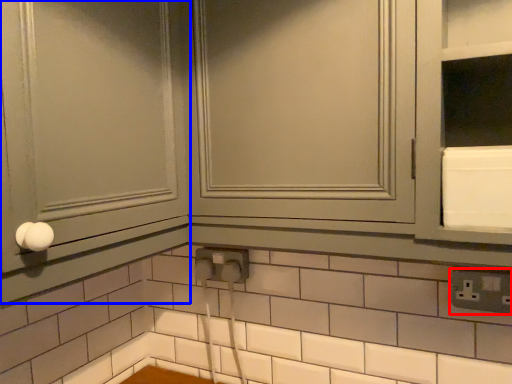
Question: Which of the following is the farthest to the observer, electric outlet (highlighted by a red box) or screen door (highlighted by a blue box)?

Choices:
 (A) electric outlet
 (B) screen door

Answer: (A)